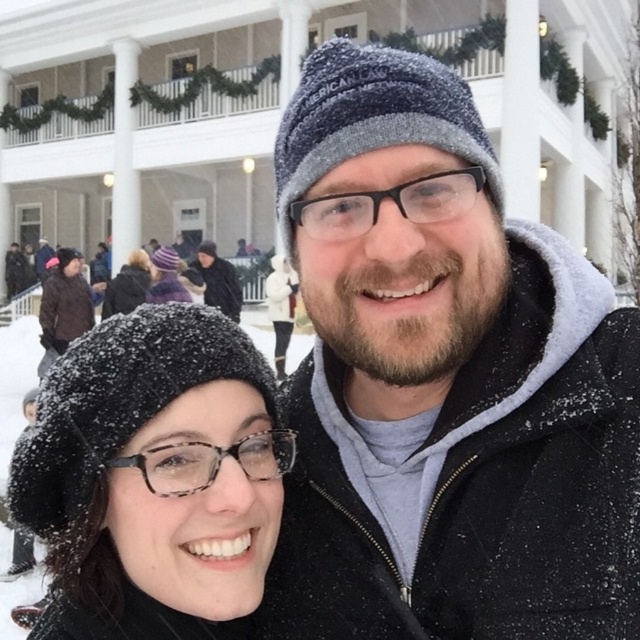
Consider the image. In the winter scene, there are two hats visible. The black knitted beret at lower left and the dark gray knit hat at center. Which hat is positioned to the right of the other?

The black knitted beret at lower left is to the right of the dark gray knit hat at center.